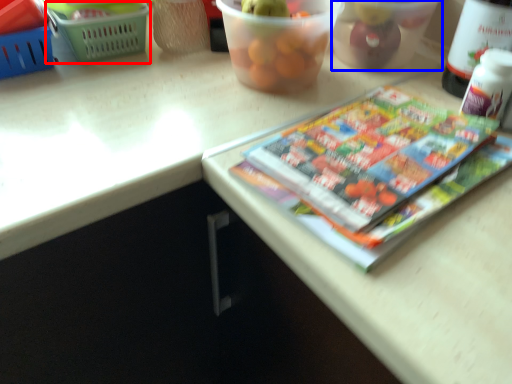
Question: Which point is closer to the camera, basket (highlighted by a red box) or glass bowl (highlighted by a blue box)?

Choices:
 (A) basket
 (B) glass bowl

Answer: (B)